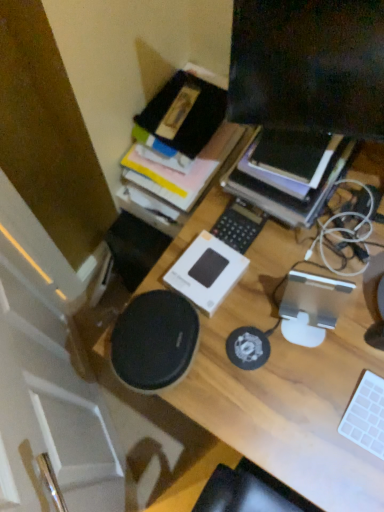
Question: Considering the relative sizes of wooden desk at center and white plastic keyboard at center, which is counted as the 2th laptop keyboard, starting from the front, in the image provided, is wooden desk at center smaller than white plastic keyboard at center, which is counted as the 2th laptop keyboard, starting from the front,?

Choices:
 (A) no
 (B) yes

Answer: (A)

Question: Is white plastic keyboard at center, placed as the 2th laptop keyboard when sorted from right to left, at the back of wooden desk at center?

Choices:
 (A) yes
 (B) no

Answer: (B)

Question: Does wooden desk at center come behind white plastic keyboard at center, arranged as the 1th laptop keyboard when viewed from the top?

Choices:
 (A) yes
 (B) no

Answer: (B)

Question: Is wooden desk at center wider than white plastic keyboard at center, marked as the second laptop keyboard in a bottom-to-top arrangement?

Choices:
 (A) no
 (B) yes

Answer: (B)

Question: Is white plastic keyboard at center, placed as the 2th laptop keyboard when sorted from right to left, surrounded by wooden desk at center?

Choices:
 (A) yes
 (B) no

Answer: (B)

Question: Looking at their shapes, would you say matte black monitor at upper right is wider or thinner than white plastic keyboard at center, arranged as the 1th laptop keyboard when viewed from the top?

Choices:
 (A) thin
 (B) wide

Answer: (A)

Question: From their relative heights in the image, would you say matte black monitor at upper right is taller or shorter than white plastic keyboard at center, placed as the 2th laptop keyboard when sorted from right to left?

Choices:
 (A) short
 (B) tall

Answer: (B)

Question: Is matte black monitor at upper right bigger or smaller than white plastic keyboard at center, the 1th laptop keyboard in the back-to-front sequence?

Choices:
 (A) small
 (B) big

Answer: (B)

Question: Is matte black monitor at upper right inside the boundaries of white plastic keyboard at center, which is counted as the first laptop keyboard, starting from the left, or outside?

Choices:
 (A) inside
 (B) outside

Answer: (B)

Question: In terms of height, does white matte keyboard at lower right, the first laptop keyboard ordered from the bottom, look taller or shorter compared to wooden desk at center?

Choices:
 (A) tall
 (B) short

Answer: (B)

Question: From a real-world perspective, relative to wooden desk at center, is white matte keyboard at lower right, the first laptop keyboard from the right, vertically above or below?

Choices:
 (A) below
 (B) above

Answer: (B)

Question: Is white matte keyboard at lower right, which is the second laptop keyboard from left to right, inside the boundaries of wooden desk at center, or outside?

Choices:
 (A) inside
 (B) outside

Answer: (A)

Question: Based on their sizes in the image, would you say white matte keyboard at lower right, which is the second laptop keyboard from left to right, is bigger or smaller than wooden desk at center?

Choices:
 (A) small
 (B) big

Answer: (A)

Question: From their relative heights in the image, would you say white plastic keyboard at center, which is counted as the 2th laptop keyboard, starting from the front, is taller or shorter than wooden desk at center?

Choices:
 (A) tall
 (B) short

Answer: (B)

Question: From a real-world perspective, is white plastic keyboard at center, placed as the 2th laptop keyboard when sorted from right to left, positioned above or below wooden desk at center?

Choices:
 (A) above
 (B) below

Answer: (A)